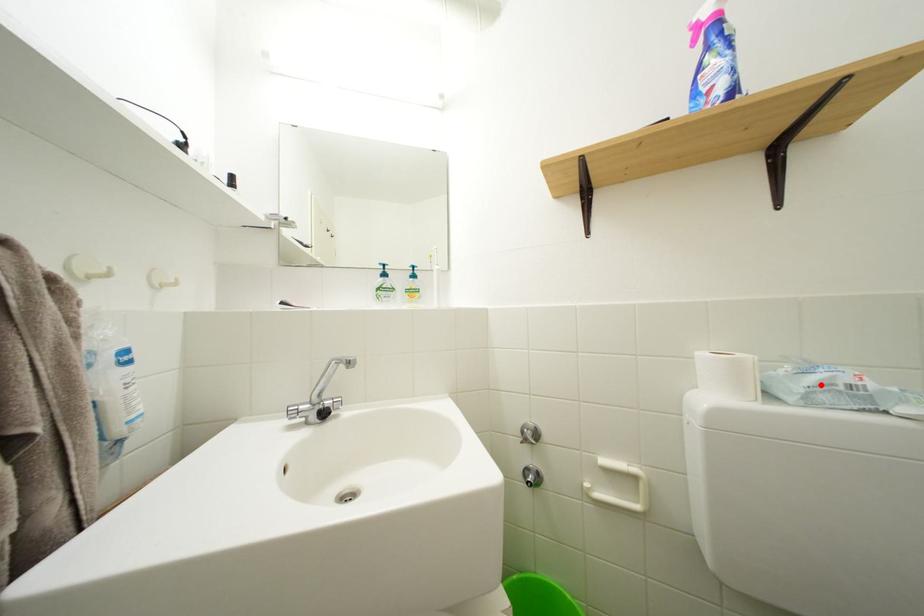
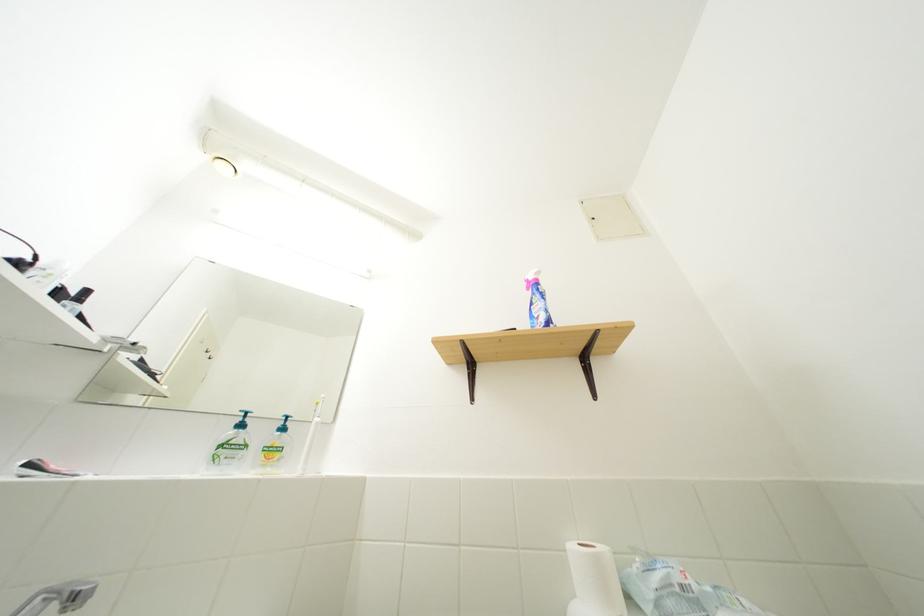
In the second image, find the point that corresponds to the highlighted location in the first image.

(665, 585)